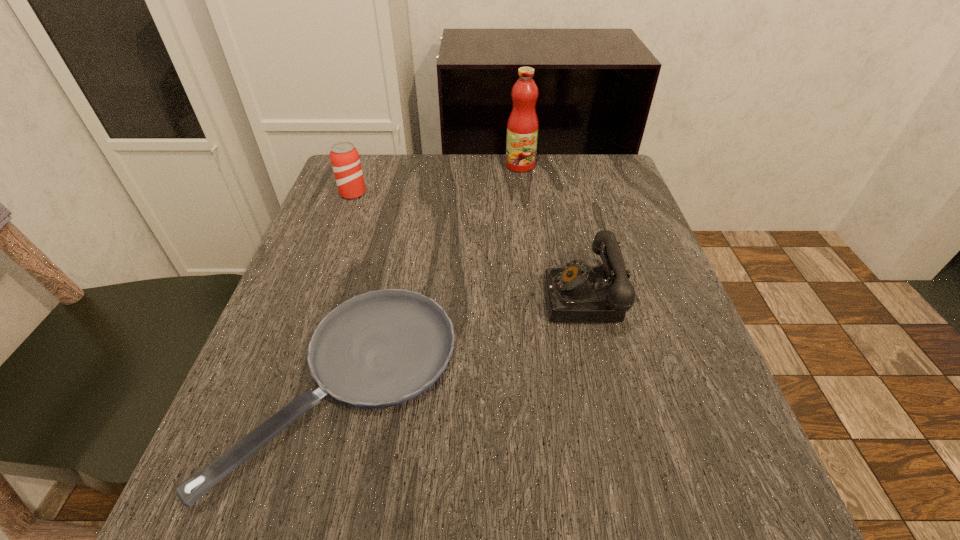
What are the coordinates of `vacant area that lies between the shortest object and the second farthest object` in the screenshot? It's located at (349, 291).

Where is `free space between the beer can and the tallest object`? The width and height of the screenshot is (960, 540). free space between the beer can and the tallest object is located at coordinates (437, 179).

The image size is (960, 540). I want to click on free spot between the frying pan and the telephone, so click(467, 342).

Identify the location of empty space between the fruit juice and the beer can. This screenshot has height=540, width=960. 437,179.

Where is `blank region between the fruit juice and the third nearest object`? Image resolution: width=960 pixels, height=540 pixels. blank region between the fruit juice and the third nearest object is located at coordinates (437, 179).

This screenshot has width=960, height=540. I want to click on object that is the second closest one to the telephone, so click(x=522, y=128).

Image resolution: width=960 pixels, height=540 pixels. In order to click on object that stands as the third closest to the shortest object in this screenshot , I will do `click(522, 128)`.

Identify the location of free space in the image that satisfies the following two spatial constraints: 1. on the dial of the telephone; 2. on the front side of the frying pan. (608, 387).